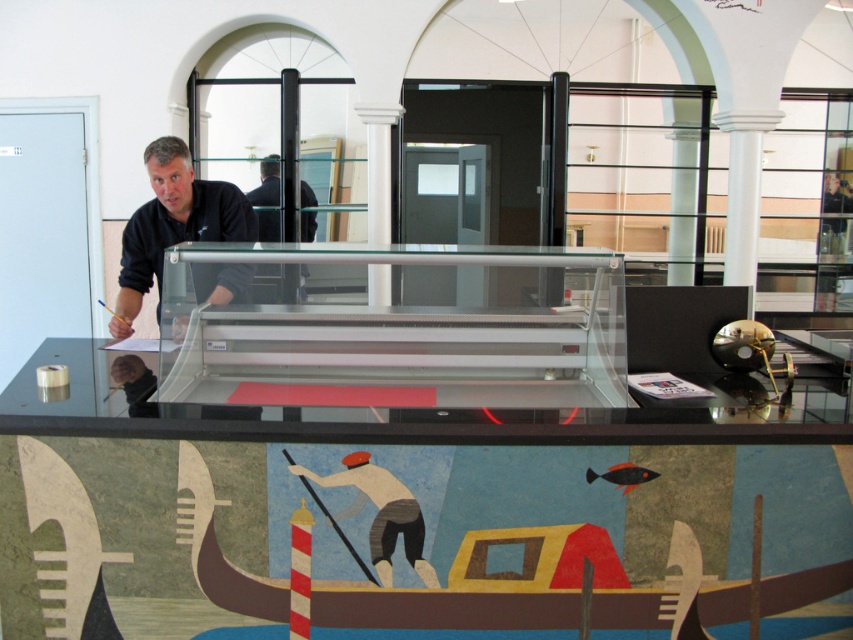
Please look at the point located at coordinates (173, 224). What object is this point located on?

The point at coordinates (173, 224) is located on the black matte shirt at upper left.